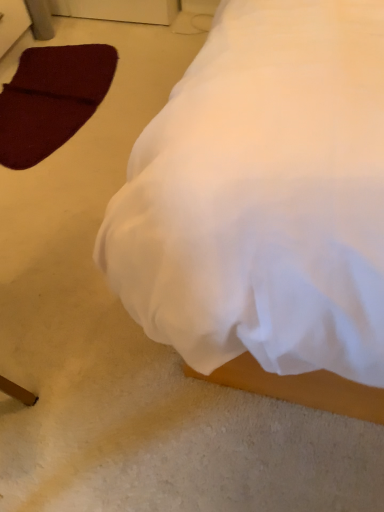
What is the approximate height of maroon felt pad at lower left?

maroon felt pad at lower left is 1.46 inches tall.

Describe the element at coordinates (51, 99) in the screenshot. I see `maroon felt pad at lower left` at that location.

At what (x,y) coordinates should I click in order to perform the action: click on maroon felt pad at lower left. Please return your answer as a coordinate pair (x, y). Image resolution: width=384 pixels, height=512 pixels. Looking at the image, I should click on (51, 99).

Describe the element at coordinates (265, 206) in the screenshot. I see `white fabric bed at lower right` at that location.

Based on the photo, measure the distance between point (140, 321) and camera.

The depth of point (140, 321) is 28.03 inches.

You are a GUI agent. You are given a task and a screenshot of the screen. Output one action in this format:
    pyautogui.click(x=<x>, y=<y>)
    Task: Click on the white fabric bed at lower right
    
    Given the screenshot: What is the action you would take?
    pyautogui.click(x=265, y=206)

At what (x,y) coordinates should I click in order to perform the action: click on maroon felt pad at lower left. Please return your answer as a coordinate pair (x, y). Looking at the image, I should click on (51, 99).

Between maroon felt pad at lower left and white fabric bed at lower right, which one appears on the right side from the viewer's perspective?

Positioned to the right is white fabric bed at lower right.

Relative to white fabric bed at lower right, is maroon felt pad at lower left in front or behind?

In the image, maroon felt pad at lower left appears behind white fabric bed at lower right.

Is point (55, 93) closer to camera compared to point (267, 94)?

No, it is behind (267, 94).

From the image's perspective, is maroon felt pad at lower left located above or below white fabric bed at lower right?

maroon felt pad at lower left is above white fabric bed at lower right.

From a real-world perspective, is maroon felt pad at lower left below white fabric bed at lower right?

Correct, in the physical world, maroon felt pad at lower left is lower than white fabric bed at lower right.

Which object is wider, maroon felt pad at lower left or white fabric bed at lower right?

white fabric bed at lower right.

Considering the relative sizes of maroon felt pad at lower left and white fabric bed at lower right in the image provided, is maroon felt pad at lower left shorter than white fabric bed at lower right?

Yes, maroon felt pad at lower left is shorter than white fabric bed at lower right.

Based on their sizes in the image, would you say maroon felt pad at lower left is bigger or smaller than white fabric bed at lower right?

maroon felt pad at lower left is smaller than white fabric bed at lower right.

Can we say maroon felt pad at lower left lies outside white fabric bed at lower right?

Absolutely, maroon felt pad at lower left is external to white fabric bed at lower right.

Is maroon felt pad at lower left not near white fabric bed at lower right?

Yes, maroon felt pad at lower left is far from white fabric bed at lower right.

Could you tell me if maroon felt pad at lower left is facing white fabric bed at lower right?

Yes, maroon felt pad at lower left is facing white fabric bed at lower right.

The width and height of the screenshot is (384, 512). What are the coordinates of `bed that is on the right side of maroon felt pad at lower left` in the screenshot? It's located at click(x=265, y=206).

Considering the relative positions of white fabric bed at lower right and maroon felt pad at lower left in the image provided, is white fabric bed at lower right to the left or to the right of maroon felt pad at lower left?

Based on their positions, white fabric bed at lower right is located to the right of maroon felt pad at lower left.

In the image, is white fabric bed at lower right positioned in front of or behind maroon felt pad at lower left?

Visually, white fabric bed at lower right is located in front of maroon felt pad at lower left.

Consider the image. Which point is more forward, (337, 128) or (32, 152)?

Point (337, 128)

From the image's perspective, which object appears higher, white fabric bed at lower right or maroon felt pad at lower left?

maroon felt pad at lower left.

From a real-world perspective, is white fabric bed at lower right physically located above or below maroon felt pad at lower left?

In terms of real-world spatial position, white fabric bed at lower right is above maroon felt pad at lower left.

Looking at their sizes, would you say white fabric bed at lower right is wider or thinner than maroon felt pad at lower left?

Clearly, white fabric bed at lower right has more width compared to maroon felt pad at lower left.

Does white fabric bed at lower right have a greater height compared to maroon felt pad at lower left?

Correct, white fabric bed at lower right is much taller as maroon felt pad at lower left.

Does white fabric bed at lower right have a smaller size compared to maroon felt pad at lower left?

Actually, white fabric bed at lower right might be larger than maroon felt pad at lower left.

Is maroon felt pad at lower left a part of white fabric bed at lower right?

No.

Is white fabric bed at lower right not near maroon felt pad at lower left?

Yes, white fabric bed at lower right and maroon felt pad at lower left are located far from each other.

Could you tell me if white fabric bed at lower right is turned towards maroon felt pad at lower left?

No, white fabric bed at lower right is not turned towards maroon felt pad at lower left.

How many degrees apart are the facing directions of white fabric bed at lower right and maroon felt pad at lower left?

The facing directions of white fabric bed at lower right and maroon felt pad at lower left are 89 degrees apart.

Measure the distance between white fabric bed at lower right and maroon felt pad at lower left.

Result: white fabric bed at lower right is 3.66 feet from maroon felt pad at lower left.

I want to click on pad that is above the white fabric bed at lower right (from the image's perspective), so click(51, 99).

This screenshot has height=512, width=384. Find the location of `pad on the left of white fabric bed at lower right`. pad on the left of white fabric bed at lower right is located at coordinates (51, 99).

Find the location of `bed in front of the maroon felt pad at lower left`. bed in front of the maroon felt pad at lower left is located at coordinates (265, 206).